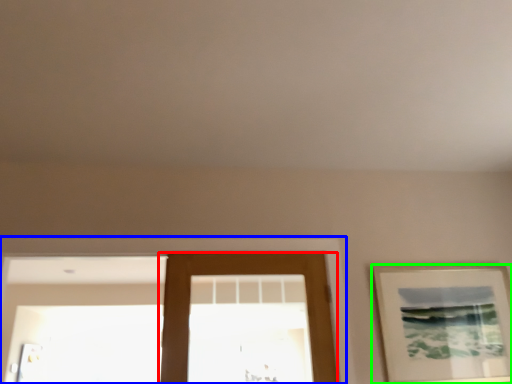
Question: Estimate the real-world distances between objects in this image. Which object is farther from door (highlighted by a red box), window frame (highlighted by a blue box) or picture frame (highlighted by a green box)?

Choices:
 (A) window frame
 (B) picture frame

Answer: (B)